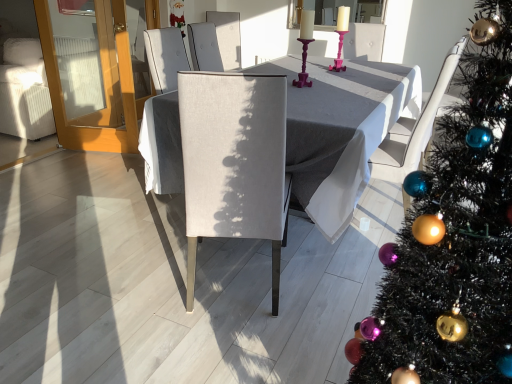
Where is `free location in front of matte gray chair at center`? free location in front of matte gray chair at center is located at coordinates pyautogui.click(x=221, y=347).